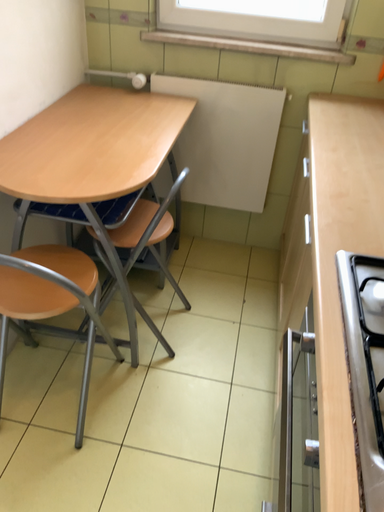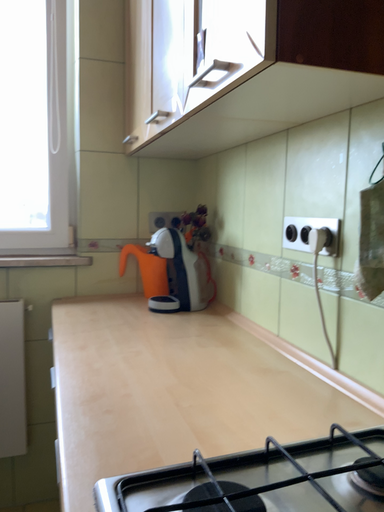
Question: Which way did the camera rotate in the video?

Choices:
 (A) rotated right
 (B) rotated left

Answer: (A)